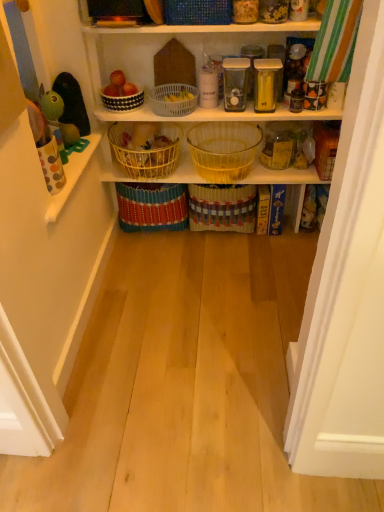
The width and height of the screenshot is (384, 512). Identify the location of space that is in front of woven straw basket at center, which is the 7th basket in top-to-bottom order. (236, 255).